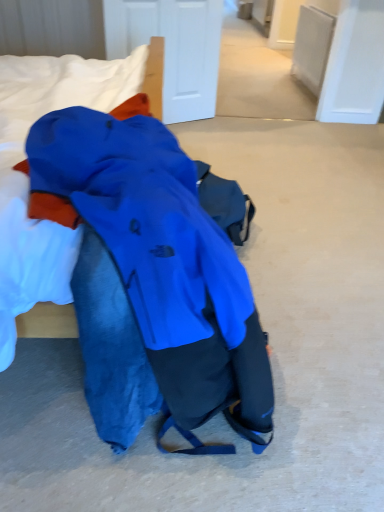
Question: Is blue fabric at upper left facing away from matte blue jacket at center?

Choices:
 (A) no
 (B) yes

Answer: (B)

Question: From a real-world perspective, is blue fabric at upper left under matte blue jacket at center?

Choices:
 (A) yes
 (B) no

Answer: (B)

Question: Does blue fabric at upper left come behind matte blue jacket at center?

Choices:
 (A) yes
 (B) no

Answer: (A)

Question: Could matte blue jacket at center be considered to be inside blue fabric at upper left?

Choices:
 (A) no
 (B) yes

Answer: (A)

Question: Is blue fabric at upper left with matte blue jacket at center?

Choices:
 (A) no
 (B) yes

Answer: (A)

Question: Is blue fabric at upper left aimed at matte blue jacket at center?

Choices:
 (A) yes
 (B) no

Answer: (A)

Question: Does matte blue jacket at center have a lesser height compared to blue fabric at upper left?

Choices:
 (A) yes
 (B) no

Answer: (B)

Question: Would you say matte blue jacket at center contains blue fabric at upper left?

Choices:
 (A) yes
 (B) no

Answer: (A)

Question: Can you confirm if matte blue jacket at center is wider than blue fabric at upper left?

Choices:
 (A) yes
 (B) no

Answer: (A)

Question: Is matte blue jacket at center thinner than blue fabric at upper left?

Choices:
 (A) yes
 (B) no

Answer: (B)

Question: Is matte blue jacket at center looking in the opposite direction of blue fabric at upper left?

Choices:
 (A) no
 (B) yes

Answer: (B)

Question: From a real-world perspective, is matte blue jacket at center on blue fabric at upper left?

Choices:
 (A) yes
 (B) no

Answer: (B)

Question: Is point (36, 113) closer or farther from the camera than point (235, 302)?

Choices:
 (A) farther
 (B) closer

Answer: (A)